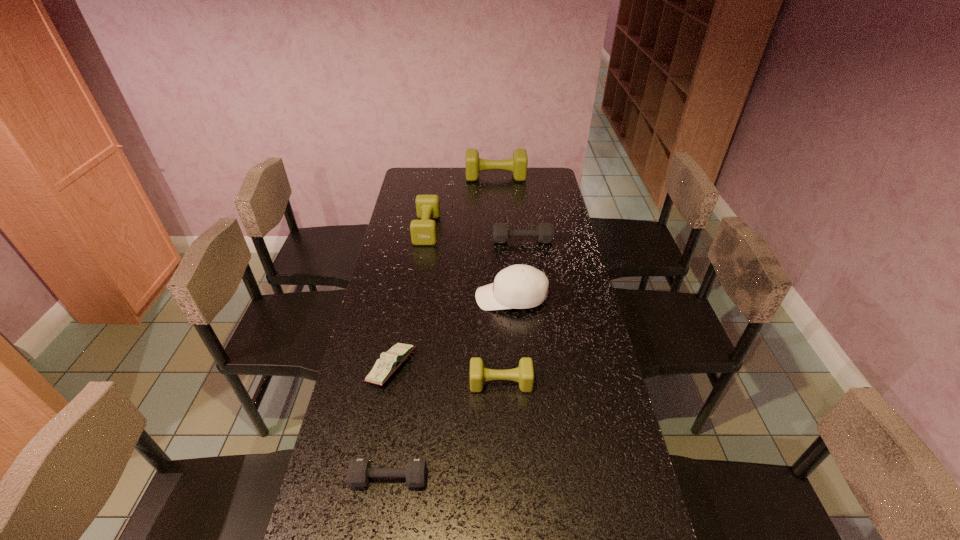
At what (x,y) coordinates should I click in order to perform the action: click on the second closest dumbbell to the fourth shortest dumbbell. Please return your answer as a coordinate pair (x, y). This screenshot has width=960, height=540. Looking at the image, I should click on (518, 164).

Identify the location of dumbbell that stands as the fourth closest to the nearest dumbbell. This screenshot has width=960, height=540. (518, 164).

Locate which olive dumbbell ranks third in proximity to the shortest dumbbell. Please provide its 2D coordinates. Your answer should be formatted as a tuple, i.e. [(x, y)], where the tuple contains the x and y coordinates of a point satisfying the conditions above.

[(518, 164)]

Identify which olive dumbbell is the nearest to the farthest olive dumbbell. Please provide its 2D coordinates. Your answer should be formatted as a tuple, i.e. [(x, y)], where the tuple contains the x and y coordinates of a point satisfying the conditions above.

[(423, 232)]